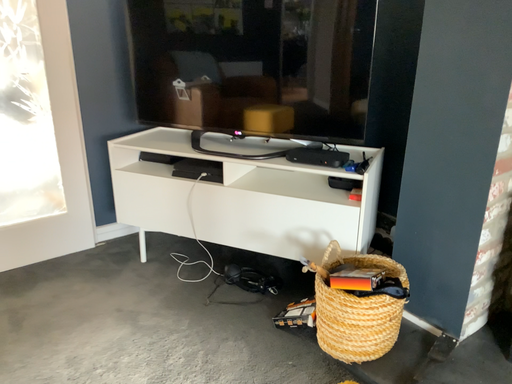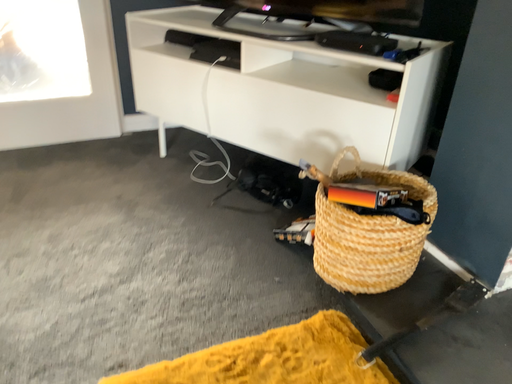
Question: How did the camera likely rotate when shooting the video?

Choices:
 (A) rotated right
 (B) rotated left

Answer: (B)